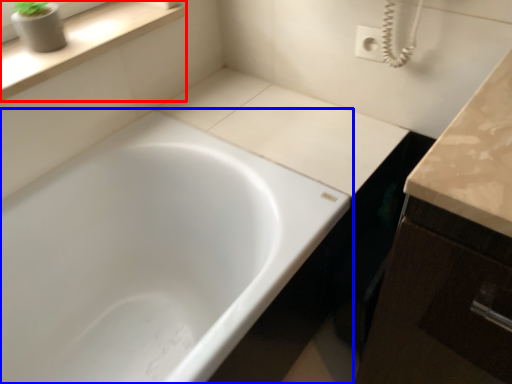
Question: Which of the following is the farthest to the observer, window sill (highlighted by a red box) or bathtub (highlighted by a blue box)?

Choices:
 (A) window sill
 (B) bathtub

Answer: (A)